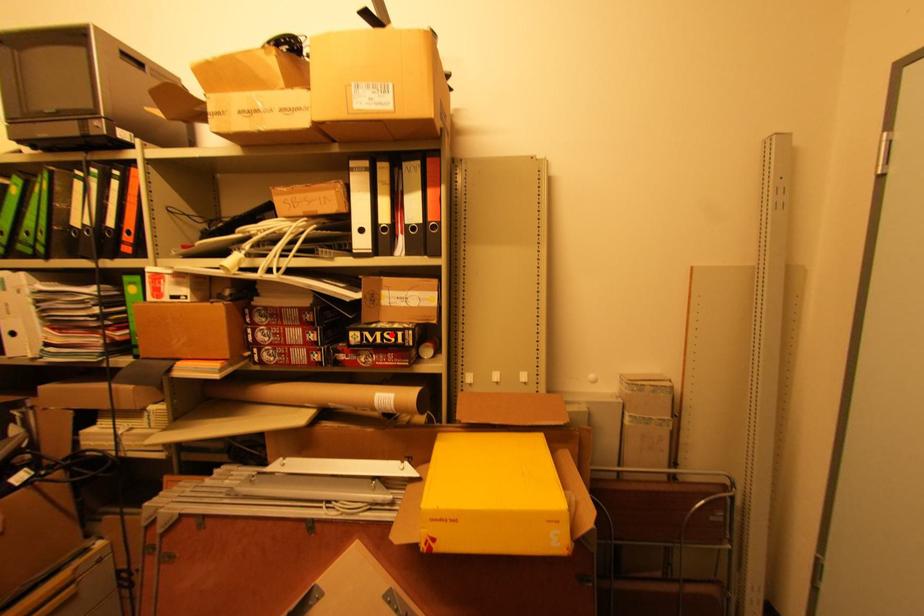
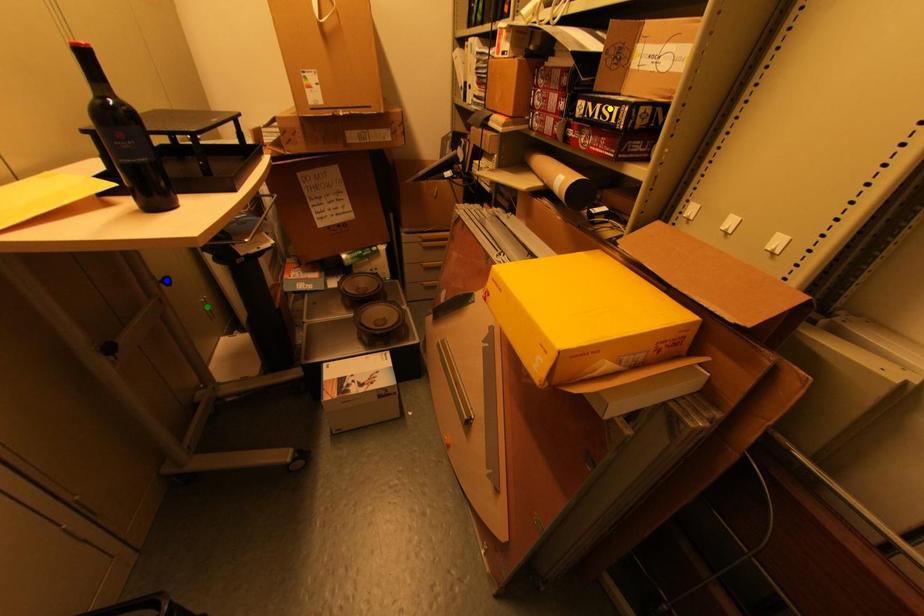
Question: I am providing you with two images of the same scene from different viewpoints. A red point is marked on the first image. You are given multiple points on the second image. Which spot in image 2 lines up with the point in image 1?

Choices:
 (A) blue point
 (B) yellow point
 (C) green point

Answer: (B)